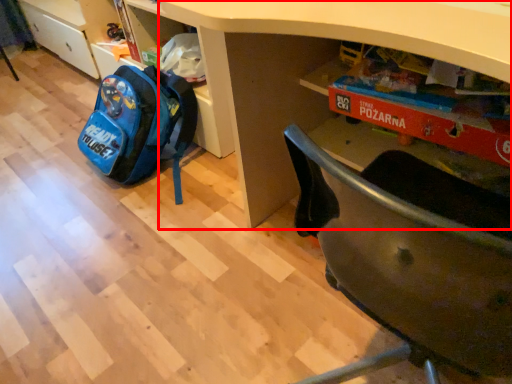
Question: From the image's perspective, considering the relative positions of desk (annotated by the red box) and backpack in the image provided, where is desk (annotated by the red box) located with respect to the staircase?

Choices:
 (A) above
 (B) below

Answer: (B)